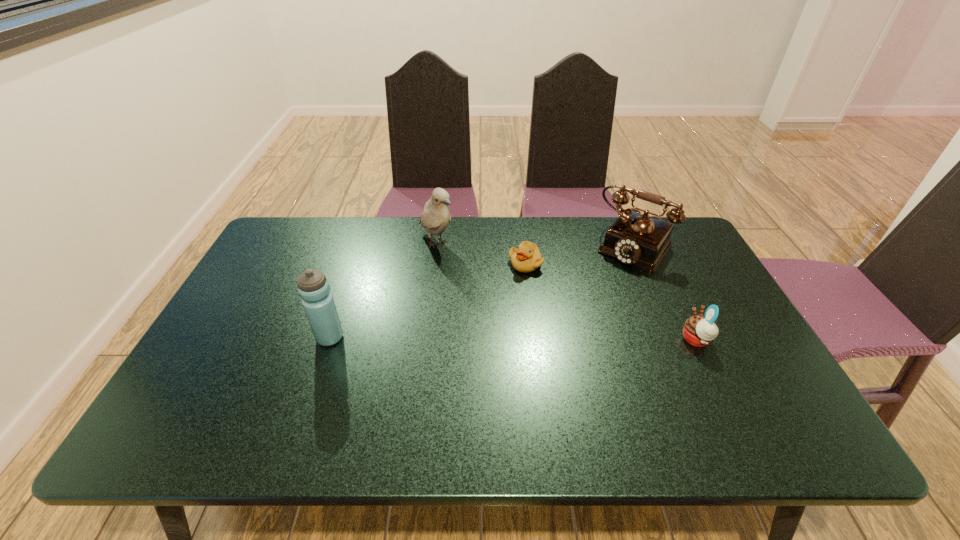
Find the location of a particular element. The image size is (960, 540). free space between the fourth tallest object and the bird is located at coordinates (566, 292).

Identify which object is the third nearest to the bird. Please provide its 2D coordinates. Your answer should be formatted as a tuple, i.e. [(x, y)], where the tuple contains the x and y coordinates of a point satisfying the conditions above.

[(637, 239)]

Locate which object is the closest to the water bottle. Please provide its 2D coordinates. Your answer should be formatted as a tuple, i.e. [(x, y)], where the tuple contains the x and y coordinates of a point satisfying the conditions above.

[(435, 218)]

This screenshot has height=540, width=960. Identify the location of vacant area that satisfies the following two spatial constraints: 1. on the front side of the muffin; 2. on the front-facing side of the telephone. (675, 340).